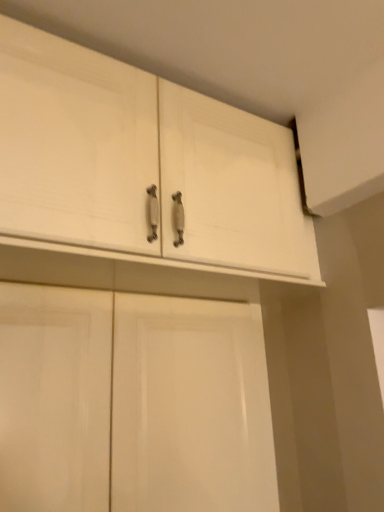
Question: Is white wood cabinet at upper center, placed as the 2th cabinetry when sorted from bottom to top, taller or shorter than white matte cabinet doors at lower center, the second cabinetry when ordered from top to bottom?

Choices:
 (A) short
 (B) tall

Answer: (A)

Question: From a real-world perspective, is white wood cabinet at upper center, the 1th cabinetry in the top-to-bottom sequence, above or below white matte cabinet doors at lower center, the second cabinetry when ordered from top to bottom?

Choices:
 (A) below
 (B) above

Answer: (B)

Question: Considering the positions of point (284, 203) and point (0, 315), is point (284, 203) closer or farther from the camera than point (0, 315)?

Choices:
 (A) closer
 (B) farther

Answer: (B)

Question: From their relative heights in the image, would you say white matte cabinet doors at lower center, arranged as the 1th cabinetry when ordered from the bottom, is taller or shorter than white wood cabinet at upper center, the 1th cabinetry in the top-to-bottom sequence?

Choices:
 (A) tall
 (B) short

Answer: (A)

Question: From a real-world perspective, is white matte cabinet doors at lower center, the second cabinetry when ordered from top to bottom, positioned above or below white wood cabinet at upper center, placed as the 2th cabinetry when sorted from bottom to top?

Choices:
 (A) below
 (B) above

Answer: (A)

Question: Relative to white wood cabinet at upper center, the 1th cabinetry in the top-to-bottom sequence, is white matte cabinet doors at lower center, the second cabinetry when ordered from top to bottom, in front or behind?

Choices:
 (A) front
 (B) behind

Answer: (B)

Question: From the image's perspective, relative to white wood cabinet at upper center, the 1th cabinetry in the top-to-bottom sequence, is white matte cabinet doors at lower center, the second cabinetry when ordered from top to bottom, above or below?

Choices:
 (A) above
 (B) below

Answer: (B)